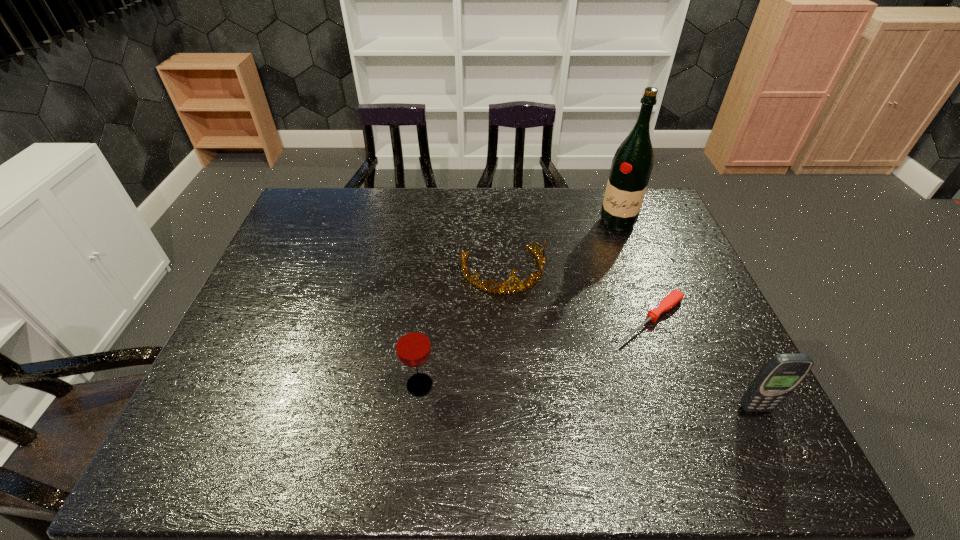
You are a GUI agent. You are given a task and a screenshot of the screen. Output one action in this format:
    pyautogui.click(x=<x>, y=<y>)
    Task: Click on the second nearest object
    Image resolution: width=960 pixels, height=540 pixels.
    Given the screenshot: What is the action you would take?
    pyautogui.click(x=412, y=343)

This screenshot has width=960, height=540. Find the location of `glass`. glass is located at coordinates (412, 343).

At what (x,y) coordinates should I click in order to perform the action: click on the rightmost object. Please return your answer as a coordinate pair (x, y). The image size is (960, 540). Looking at the image, I should click on (781, 375).

Locate an element on the screen. This screenshot has height=540, width=960. the nearest object is located at coordinates (781, 375).

Find the location of a particular element. This screenshot has width=960, height=540. liquor is located at coordinates (631, 167).

Locate an element on the screen. the farthest object is located at coordinates (631, 167).

In order to click on the shortest object in this screenshot , I will do `click(675, 297)`.

This screenshot has width=960, height=540. In order to click on the second shortest object in this screenshot , I will do `click(522, 285)`.

Image resolution: width=960 pixels, height=540 pixels. I want to click on tiara, so click(x=522, y=285).

Find the location of a particular element. The height and width of the screenshot is (540, 960). free space located 0.160m on the back of the leftmost object is located at coordinates (427, 320).